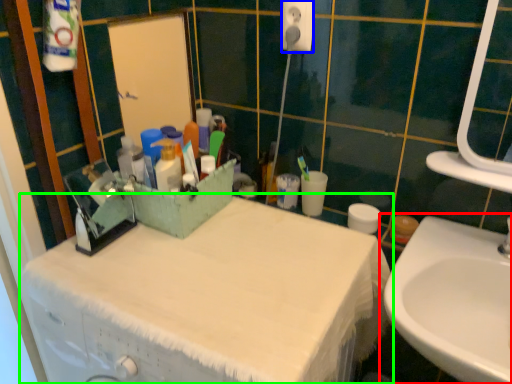
Question: Estimate the real-world distances between objects in this image. Which object is closer to sink (highlighted by a red box), electric outlet (highlighted by a blue box) or bathroom cabinet (highlighted by a green box)?

Choices:
 (A) electric outlet
 (B) bathroom cabinet

Answer: (B)